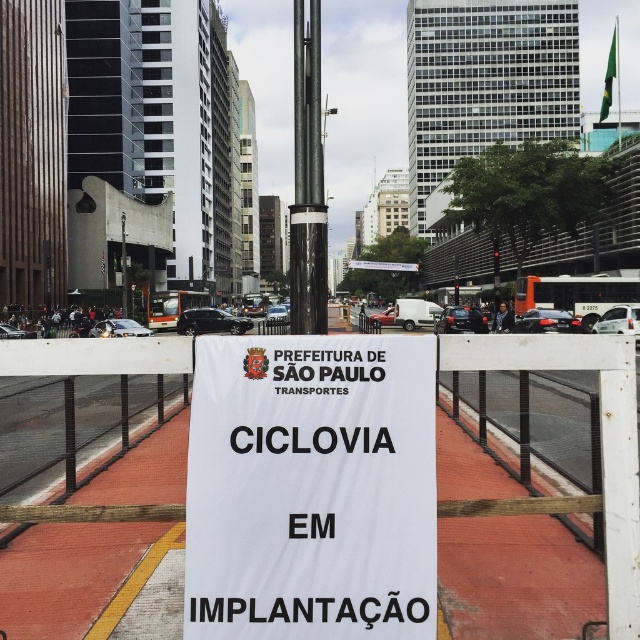
Question: Which of the following is the farthest from the observer?

Choices:
 (A) white mesh fence at center
 (B) metallic pole at center

Answer: (B)

Question: From the image, what is the correct spatial relationship of white paper sign at center in relation to metallic pole at center?

Choices:
 (A) right
 (B) left

Answer: (A)

Question: Among these objects, which one is farthest from the camera?

Choices:
 (A) white mesh fence at center
 (B) metallic pole at center
 (C) white paper sign at center

Answer: (B)

Question: Is white mesh fence at center wider than metallic pole at center?

Choices:
 (A) yes
 (B) no

Answer: (B)

Question: Does white mesh fence at center have a larger size compared to metallic pole at center?

Choices:
 (A) no
 (B) yes

Answer: (A)

Question: Which of the following is the closest to the observer?

Choices:
 (A) (320, 259)
 (B) (605, 433)

Answer: (B)